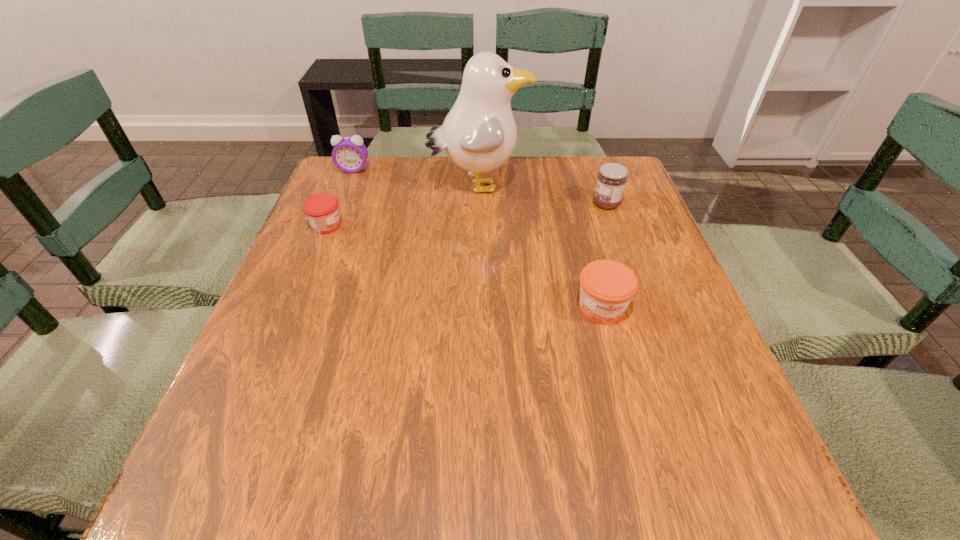
Where is `vacant area that lies between the tallest object and the shortest object`? vacant area that lies between the tallest object and the shortest object is located at coordinates (402, 206).

Locate an element on the screen. This screenshot has height=540, width=960. vacant area that lies between the nearest jam and the shortest jam is located at coordinates (464, 267).

Find the location of `vacant space in between the third object from right to left and the farthest jam`. vacant space in between the third object from right to left and the farthest jam is located at coordinates [542, 195].

Locate an element on the screen. The image size is (960, 540). unoccupied area between the nearest object and the leftmost jam is located at coordinates (464, 267).

Find the location of `free space between the fourth farthest object and the alarm clock`. free space between the fourth farthest object and the alarm clock is located at coordinates (340, 198).

At what (x,y) coordinates should I click in order to perform the action: click on object that is the fourth closest to the nearest jam. Please return your answer as a coordinate pair (x, y). The height and width of the screenshot is (540, 960). Looking at the image, I should click on (350, 154).

Identify the location of the fourth closest object to the tallest object. (607, 287).

Select which jam appears as the second closest to the nearest jam. Please provide its 2D coordinates. Your answer should be formatted as a tuple, i.e. [(x, y)], where the tuple contains the x and y coordinates of a point satisfying the conditions above.

[(322, 210)]

Select which jam is the second closest to the nearest jam. Please provide its 2D coordinates. Your answer should be formatted as a tuple, i.e. [(x, y)], where the tuple contains the x and y coordinates of a point satisfying the conditions above.

[(322, 210)]

Locate an element on the screen. Image resolution: width=960 pixels, height=540 pixels. vacant position in the image that satisfies the following two spatial constraints: 1. on the face of the alarm clock; 2. on the label side of the shortest object is located at coordinates (331, 226).